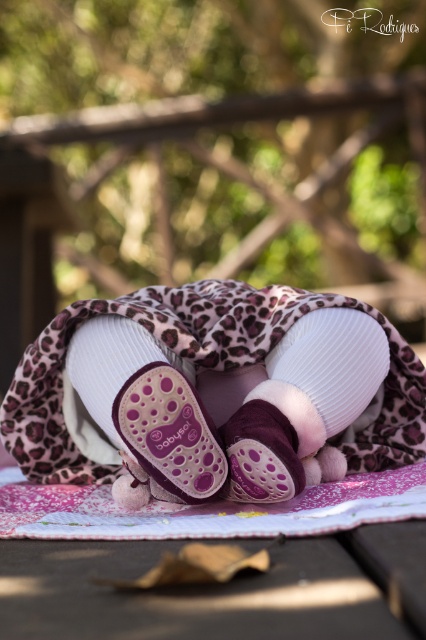
You are a parent trying to put the purple suede baby bootie at center and the white ribbed sock at center on your baby. Which one should you put on first considering their sizes?

The purple suede baby bootie at center has a smaller size compared to the white ribbed sock at center, so you should put the purple suede baby bootie at center on first to ensure proper fit and comfort.